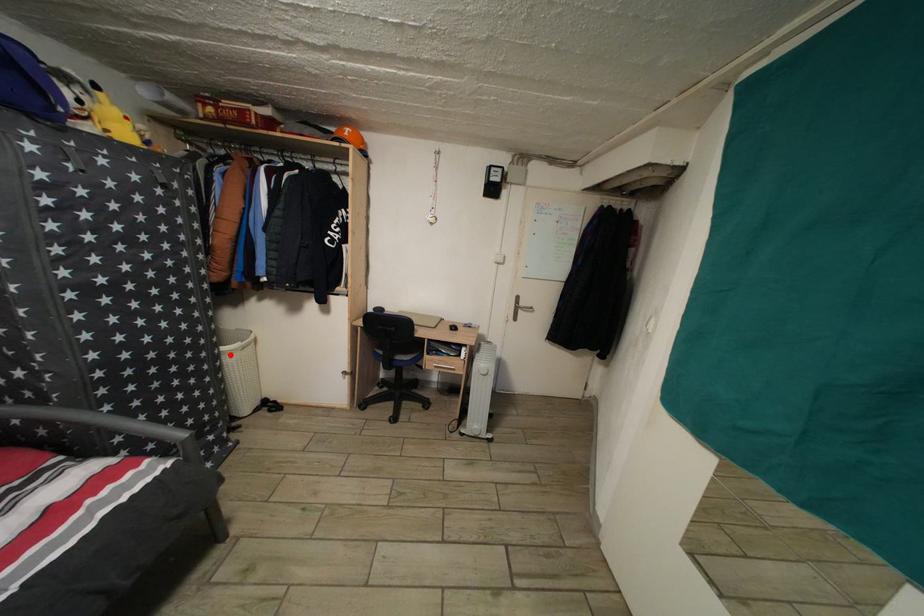
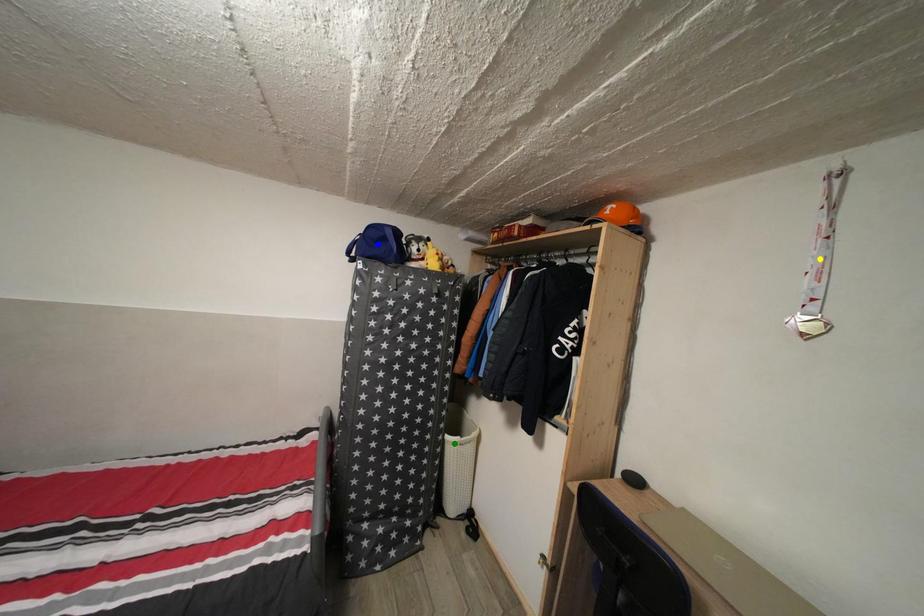
Question: I am providing you with two images of the same scene from different viewpoints. A red point is marked on the first image. You are given multiple points on the second image. In image 2, which mark is for the same physical point as the one in image 1?

Choices:
 (A) blue point
 (B) yellow point
 (C) green point

Answer: (C)